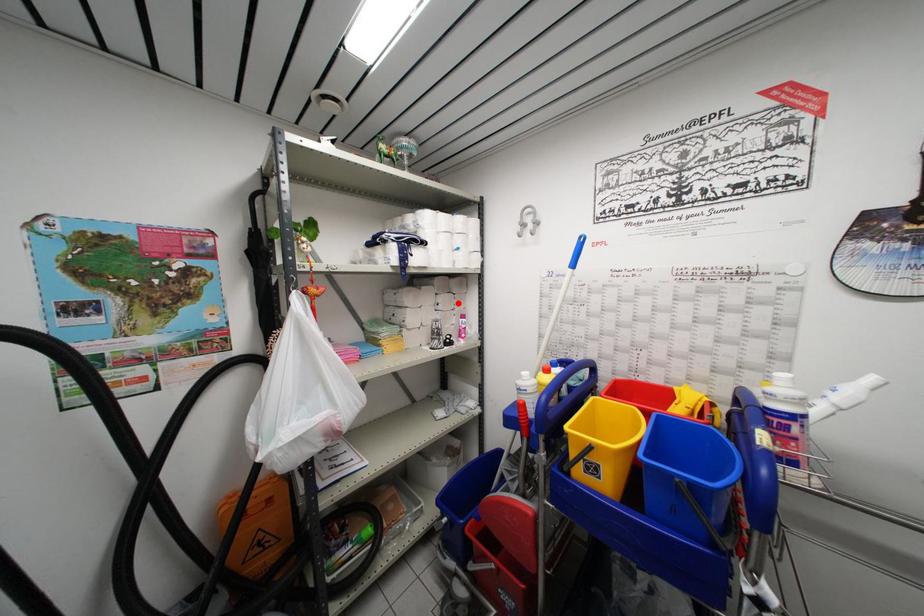
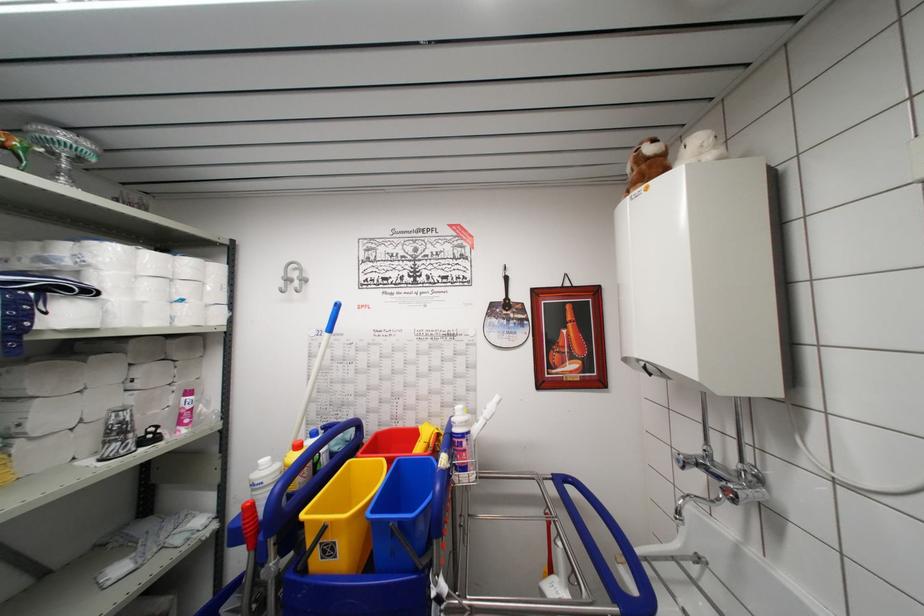
Locate, in the second image, the point that corresponds to the highlighted location in the first image.

(178, 371)